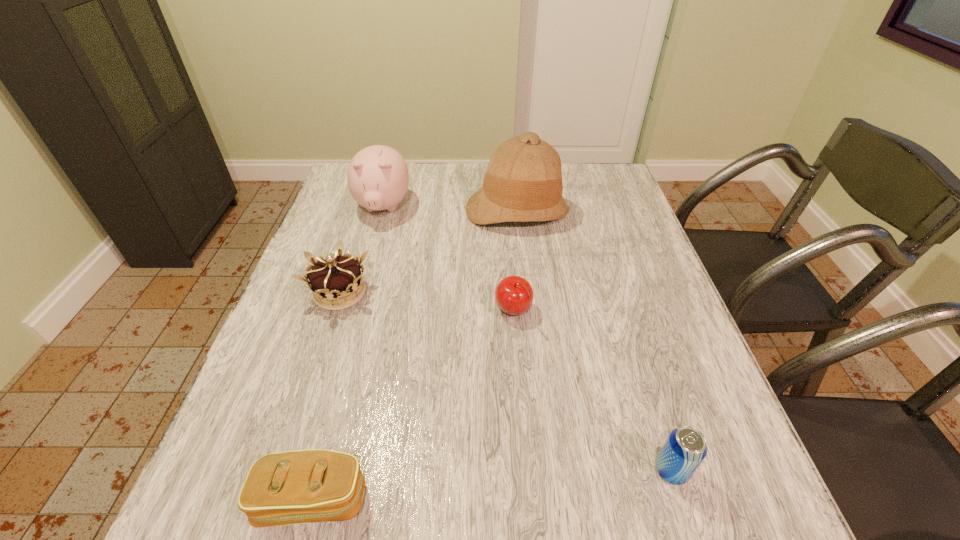
Locate an element on the screen. The width and height of the screenshot is (960, 540). free spot that satisfies the following two spatial constraints: 1. at the snout of the beer can; 2. on the right side of the second tallest object is located at coordinates (309, 470).

Locate an element on the screen. The width and height of the screenshot is (960, 540). vacant space that satisfies the following two spatial constraints: 1. at the snout of the rightmost object; 2. on the left side of the fifth shortest object is located at coordinates (309, 470).

Identify the location of free spot that satisfies the following two spatial constraints: 1. at the snout of the rightmost object; 2. on the left side of the second tallest object. This screenshot has height=540, width=960. (309, 470).